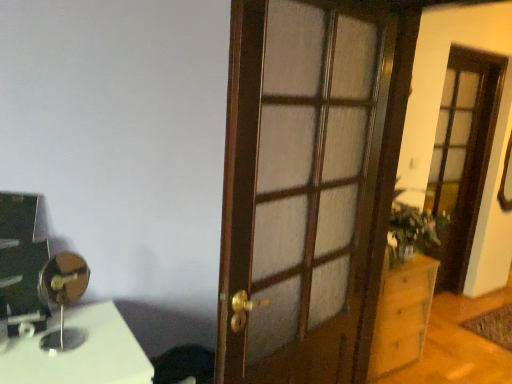
Where is `empty space that is ontop of wooden screen door at right (from a real-world perspective)`? The width and height of the screenshot is (512, 384). empty space that is ontop of wooden screen door at right (from a real-world perspective) is located at coordinates (470, 51).